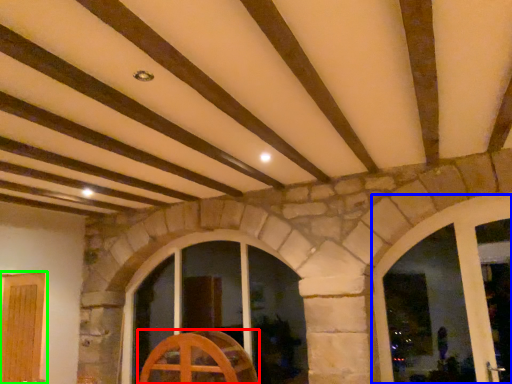
Question: Based on their relative distances, which object is farther from furniture (highlighted by a red box)? Choose from window (highlighted by a blue box) and door (highlighted by a green box).

Choices:
 (A) window
 (B) door

Answer: (A)